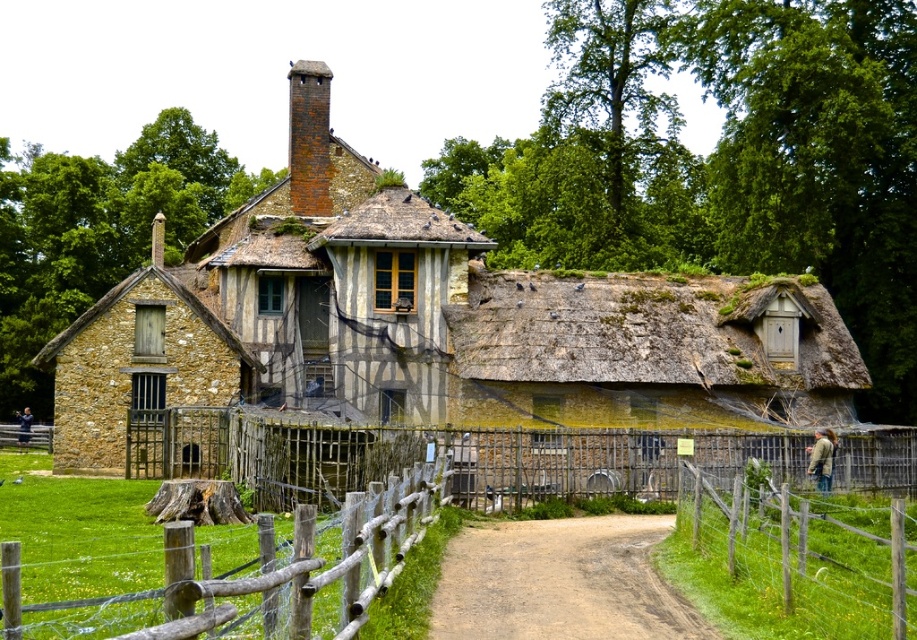
Question: Does wooden rustic fence at center appear on the left side of wooden fence at right?

Choices:
 (A) no
 (B) yes

Answer: (B)

Question: Which point is closer to the camera taking this photo?

Choices:
 (A) (294, 131)
 (B) (572, 554)

Answer: (B)

Question: Among these objects, which one is farthest from the camera?

Choices:
 (A) wooden rustic fence at center
 (B) wooden fence at center
 (C) wooden fence at right
 (D) rustic stone cottage at center

Answer: (D)

Question: Can you confirm if wooden fence at center is thinner than rusty brick chimney at upper center?

Choices:
 (A) no
 (B) yes

Answer: (A)

Question: Is brown dirt track at center further to camera compared to rusty brick chimney at upper center?

Choices:
 (A) no
 (B) yes

Answer: (A)

Question: Which is nearer to the brown dirt track at center?

Choices:
 (A) wooden fence at right
 (B) rusty brick chimney at upper center
 (C) wooden rustic fence at center
 (D) wooden fence at center

Answer: (A)